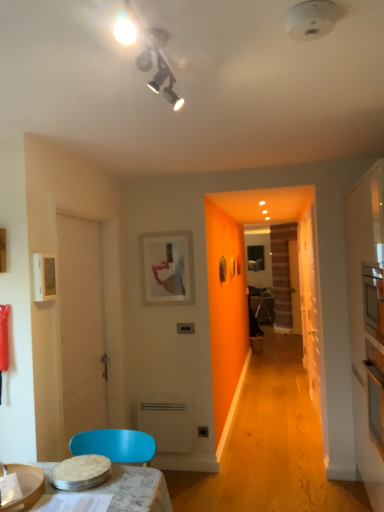
Where is `free space below white plastic radiator at lower center (from a real-world perspective)`? The image size is (384, 512). free space below white plastic radiator at lower center (from a real-world perspective) is located at coordinates (170, 468).